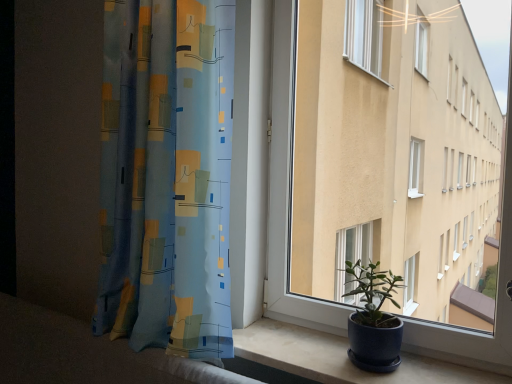
Question: Is matte concrete window sill at lower right taller or shorter than blue fabric curtain at left?

Choices:
 (A) short
 (B) tall

Answer: (A)

Question: From a real-world perspective, is matte concrete window sill at lower right above or below blue fabric curtain at left?

Choices:
 (A) below
 (B) above

Answer: (A)

Question: Estimate the real-world distances between objects in this image. Which object is closer to the matte concrete window sill at lower right?

Choices:
 (A) blue fabric curtain at left
 (B) matte blue pot at lower right
 (C) matte white window at center

Answer: (B)

Question: Which of these objects is positioned closest to the blue fabric curtain at left?

Choices:
 (A) matte blue pot at lower right
 (B) matte concrete window sill at lower right
 (C) matte white window at center

Answer: (C)